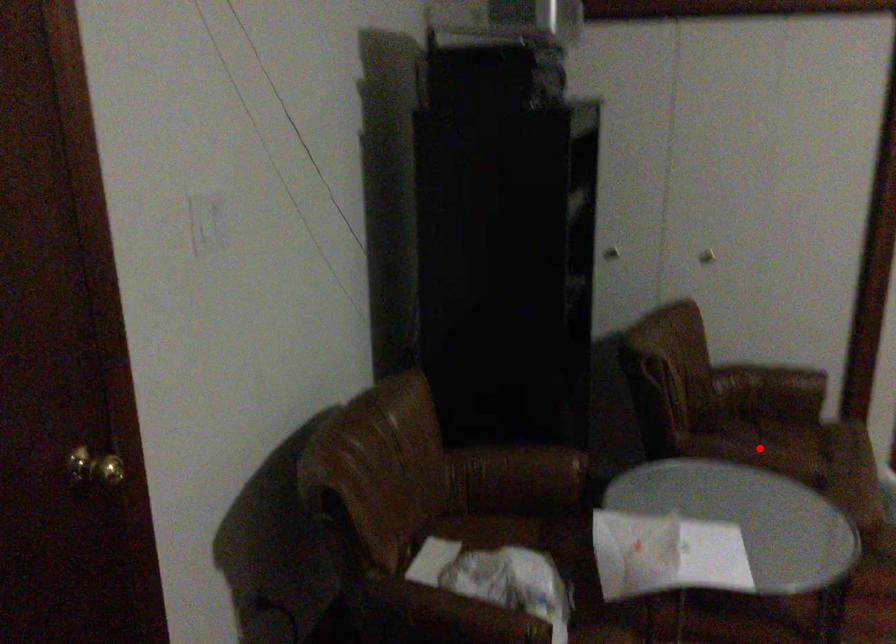
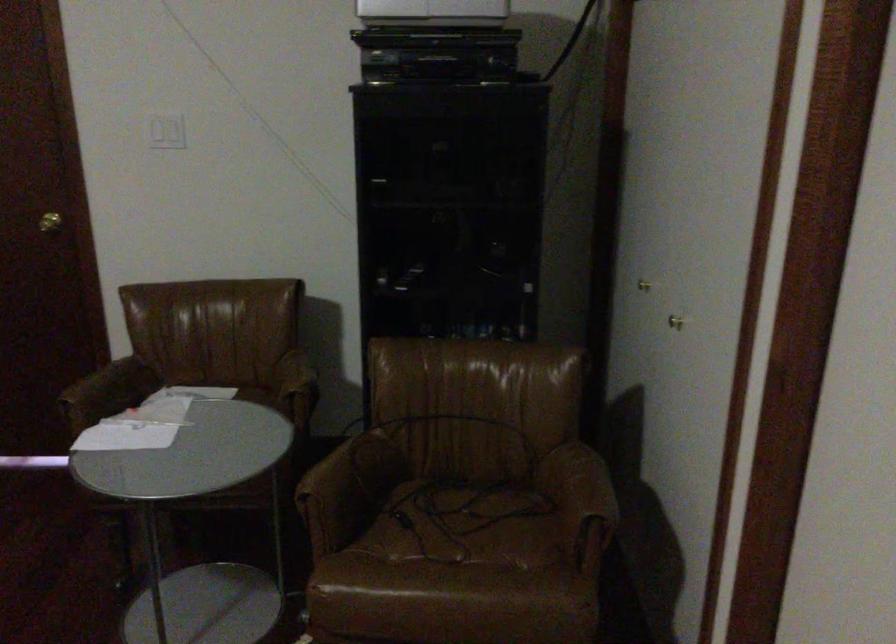
Locate, in the second image, the point that corresponds to the highlighted location in the first image.

(464, 525)